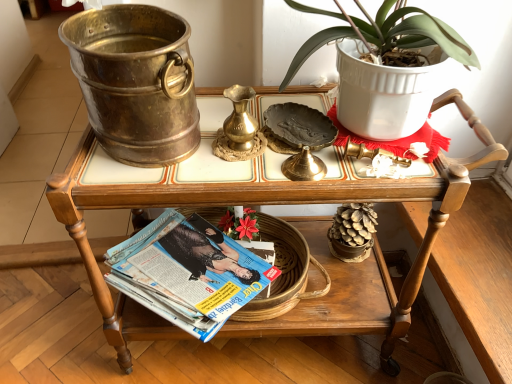
Question: Considering the relative sizes of wooden serving cart at center and matte paper magazine at lower center in the image provided, is wooden serving cart at center shorter than matte paper magazine at lower center?

Choices:
 (A) no
 (B) yes

Answer: (A)

Question: Is matte paper magazine at lower center surrounded by wooden serving cart at center?

Choices:
 (A) no
 (B) yes

Answer: (B)

Question: Is there a large distance between wooden serving cart at center and matte paper magazine at lower center?

Choices:
 (A) no
 (B) yes

Answer: (A)

Question: From the image's perspective, does wooden serving cart at center appear higher than matte paper magazine at lower center?

Choices:
 (A) yes
 (B) no

Answer: (A)

Question: From a real-world perspective, is wooden serving cart at center physically above matte paper magazine at lower center?

Choices:
 (A) yes
 (B) no

Answer: (A)

Question: From the image's perspective, is wooden serving cart at center under matte paper magazine at lower center?

Choices:
 (A) yes
 (B) no

Answer: (B)

Question: Can you confirm if matte paper magazine at lower center is shorter than wooden serving cart at center?

Choices:
 (A) yes
 (B) no

Answer: (A)

Question: Could wooden serving cart at center be considered to be inside matte paper magazine at lower center?

Choices:
 (A) no
 (B) yes

Answer: (A)

Question: From the image's perspective, is matte paper magazine at lower center on top of wooden serving cart at center?

Choices:
 (A) yes
 (B) no

Answer: (B)

Question: From a real-world perspective, is matte paper magazine at lower center on top of wooden serving cart at center?

Choices:
 (A) no
 (B) yes

Answer: (A)

Question: Is wooden serving cart at center at the back of matte paper magazine at lower center?

Choices:
 (A) yes
 (B) no

Answer: (A)

Question: Is matte paper magazine at lower center taller than wooden serving cart at center?

Choices:
 (A) no
 (B) yes

Answer: (A)

Question: Is matte paper magazine at lower center in front of or behind wooden serving cart at center in the image?

Choices:
 (A) front
 (B) behind

Answer: (B)